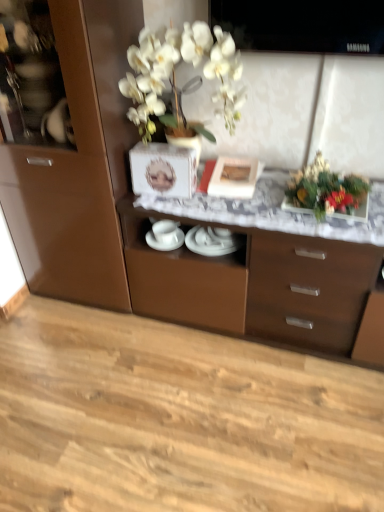
You are a GUI agent. You are given a task and a screenshot of the screen. Output one action in this format:
    pyautogui.click(x=<x>, y=<y>)
    Task: Click on the vacant area situated below shiny metallic vase at upper right (from a real-world perspective)
    
    Given the screenshot: What is the action you would take?
    pyautogui.click(x=312, y=208)